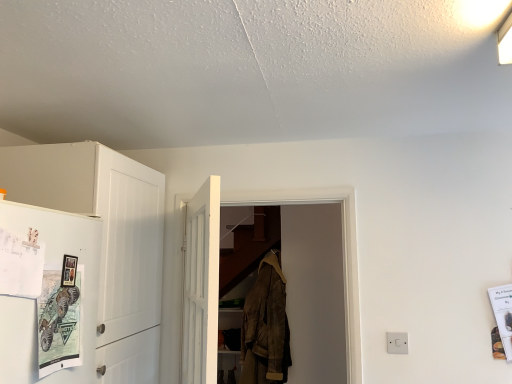
Question: From a real-world perspective, does white glossy refrigerator at left sit lower than white plastic switch at lower right?

Choices:
 (A) yes
 (B) no

Answer: (B)

Question: Can white plastic switch at lower right be found inside white glossy refrigerator at left?

Choices:
 (A) no
 (B) yes

Answer: (A)

Question: Does white glossy refrigerator at left have a greater height compared to white plastic switch at lower right?

Choices:
 (A) yes
 (B) no

Answer: (A)

Question: Is white glossy refrigerator at left wider than white plastic switch at lower right?

Choices:
 (A) no
 (B) yes

Answer: (B)

Question: Can you confirm if white glossy refrigerator at left is bigger than white plastic switch at lower right?

Choices:
 (A) no
 (B) yes

Answer: (B)

Question: From the image's perspective, is white glossy refrigerator at left on white plastic switch at lower right?

Choices:
 (A) yes
 (B) no

Answer: (A)

Question: Is white glossy refrigerator at left at the left side of white wooden door at center, the second door positioned from the back?

Choices:
 (A) yes
 (B) no

Answer: (A)

Question: Does white glossy refrigerator at left have a larger size compared to white wooden door at center, the second door positioned from the back?

Choices:
 (A) yes
 (B) no

Answer: (B)

Question: Does white glossy refrigerator at left have a lesser width compared to white wooden door at center, the second door positioned from the back?

Choices:
 (A) no
 (B) yes

Answer: (B)

Question: From the image's perspective, is white glossy refrigerator at left on top of white wooden door at center, which is counted as the first door, starting from the front?

Choices:
 (A) yes
 (B) no

Answer: (A)

Question: From a real-world perspective, is white glossy refrigerator at left located higher than white wooden door at center, the second door positioned from the back?

Choices:
 (A) no
 (B) yes

Answer: (B)

Question: Is white glossy refrigerator at left in front of white wooden door at center, the second door positioned from the back?

Choices:
 (A) yes
 (B) no

Answer: (A)

Question: Considering the relative sizes of white plastic switch at lower right and white wooden door at center, which is counted as the first door, starting from the front, in the image provided, is white plastic switch at lower right smaller than white wooden door at center, which is counted as the first door, starting from the front,?

Choices:
 (A) yes
 (B) no

Answer: (A)